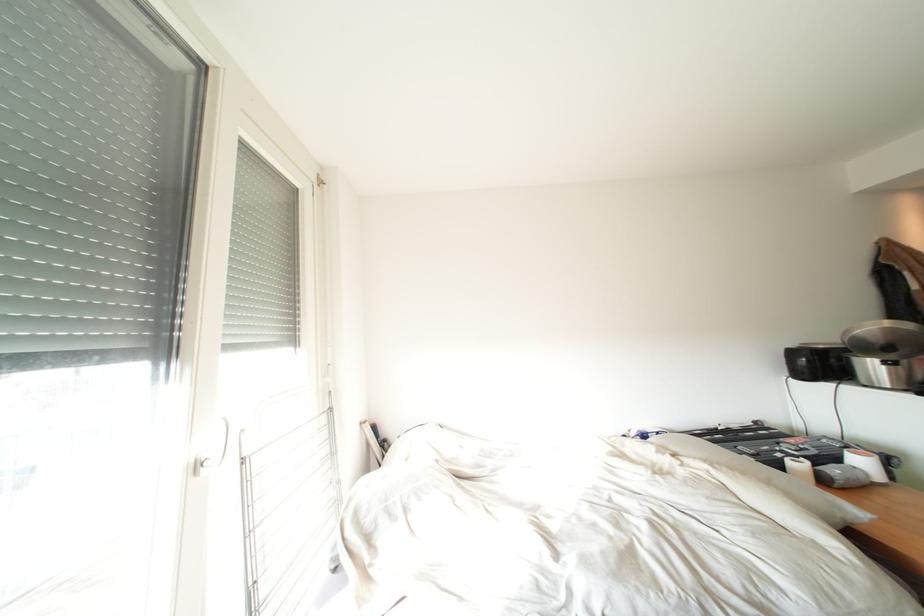
Find the location of a particular element. The height and width of the screenshot is (616, 924). black control knob is located at coordinates (890, 464).